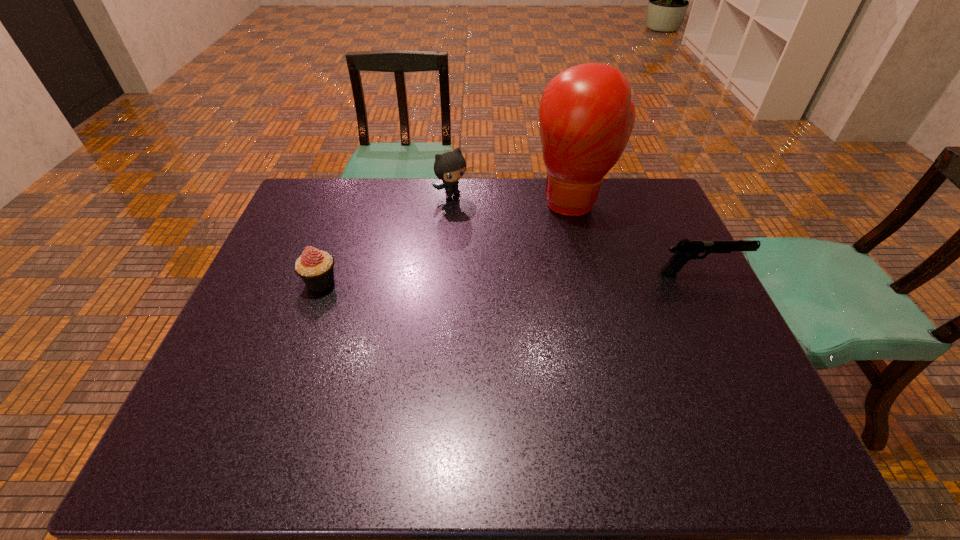
The width and height of the screenshot is (960, 540). In order to click on unoccupied position between the kitten and the leftmost object in this screenshot , I will do `click(387, 238)`.

What are the coordinates of `free space between the leftmost object and the third object from right to left` in the screenshot? It's located at (387, 238).

This screenshot has width=960, height=540. Identify the location of vacant area that lies between the cupcake and the gun. (511, 278).

Identify the location of unoccupied position between the gun and the tallest object. The image size is (960, 540). (637, 238).

Where is `object that is the third nearest to the cupcake`? The width and height of the screenshot is (960, 540). object that is the third nearest to the cupcake is located at coordinates (685, 250).

Select which object appears as the closest to the gun. Please provide its 2D coordinates. Your answer should be formatted as a tuple, i.e. [(x, y)], where the tuple contains the x and y coordinates of a point satisfying the conditions above.

[(586, 116)]

Locate an element on the screen. This screenshot has width=960, height=540. free space that satisfies the following two spatial constraints: 1. on the front side of the kitten; 2. on the right side of the boxing glove is located at coordinates (453, 202).